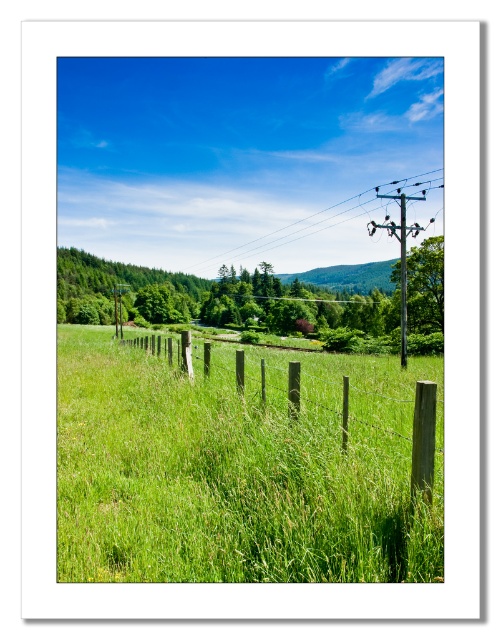
Question: Which point is farther to the camera?

Choices:
 (A) (373, 228)
 (B) (414, 460)
 (C) (335, 184)

Answer: (C)

Question: Which of the following is the farthest from the observer?

Choices:
 (A) brown wooden fence at center
 (B) smooth wooden telegraph pole at right
 (C) metallic wire at upper right

Answer: (C)

Question: Can you confirm if brown wooden fence at center is bigger than smooth wooden telegraph pole at right?

Choices:
 (A) yes
 (B) no

Answer: (B)

Question: Is metallic wire at upper right to the left of smooth wooden telegraph pole at right from the viewer's perspective?

Choices:
 (A) no
 (B) yes

Answer: (B)

Question: Which of the following is the closest to the observer?

Choices:
 (A) (191, 212)
 (B) (384, 227)

Answer: (B)

Question: Can you confirm if brown wooden fence at center is positioned to the left of smooth wooden telegraph pole at right?

Choices:
 (A) yes
 (B) no

Answer: (A)